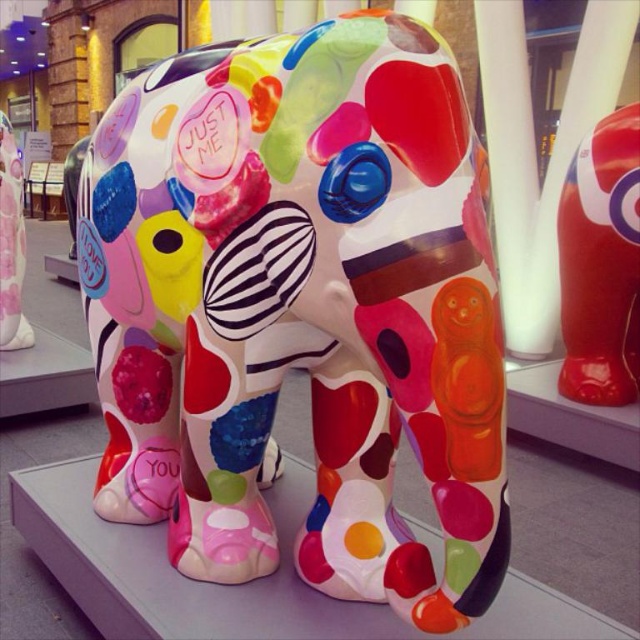
Question: Does shiny red elephant at center lie behind white glossy pillar at center?

Choices:
 (A) no
 (B) yes

Answer: (A)

Question: Among these points, which one is farthest from the camera?

Choices:
 (A) (628, 124)
 (B) (506, 234)

Answer: (B)

Question: From the image, what is the correct spatial relationship of shiny red elephant at center in relation to matte plastic elephant at center?

Choices:
 (A) right
 (B) left

Answer: (A)

Question: Which point is closer to the camera?

Choices:
 (A) shiny red elephant at center
 (B) white glossy pillar at center
 (C) multicolored glossy elephant at center

Answer: (C)

Question: Is shiny red elephant at center wider than white glossy pillar at center?

Choices:
 (A) no
 (B) yes

Answer: (A)

Question: Which point is farther to the camera?

Choices:
 (A) white glossy pillar at center
 (B) shiny red elephant at center
 (C) multicolored glossy elephant at center

Answer: (A)